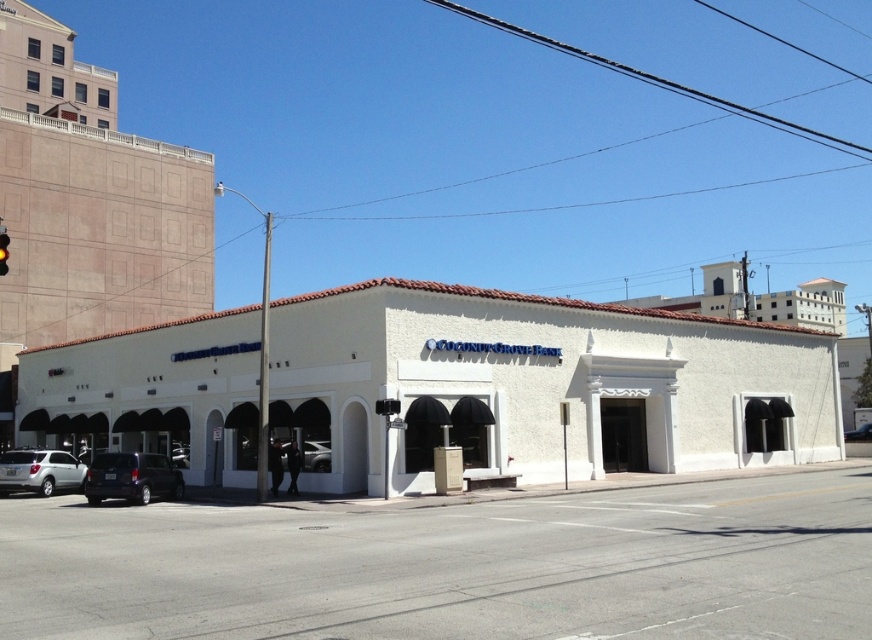
Question: Can you confirm if satin black suv at lower left is positioned below red glass traffic light at left?

Choices:
 (A) no
 (B) yes

Answer: (B)

Question: Which of the following is the farthest from the observer?

Choices:
 (A) (777, 476)
 (B) (41, 467)

Answer: (A)

Question: Can you confirm if white concrete street at lower center is smaller than white stucco building at center?

Choices:
 (A) yes
 (B) no

Answer: (A)

Question: Is satin black suv at lower left to the left of matte black suv at center from the viewer's perspective?

Choices:
 (A) yes
 (B) no

Answer: (A)

Question: Based on their relative distances, which object is nearer to the white concrete street at lower center?

Choices:
 (A) matte black suv at center
 (B) red glass traffic light at left

Answer: (B)

Question: Which point is closer to the camera?

Choices:
 (A) (159, 456)
 (B) (328, 468)
 (C) (0, 225)

Answer: (A)